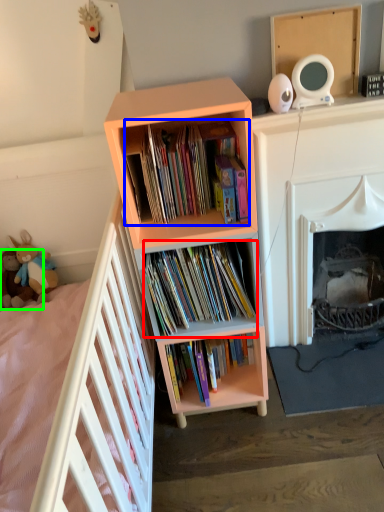
Question: Based on their relative distances, which object is farther from book (highlighted by a red box)? Choose from book (highlighted by a blue box) and toy (highlighted by a green box).

Choices:
 (A) book
 (B) toy

Answer: (B)